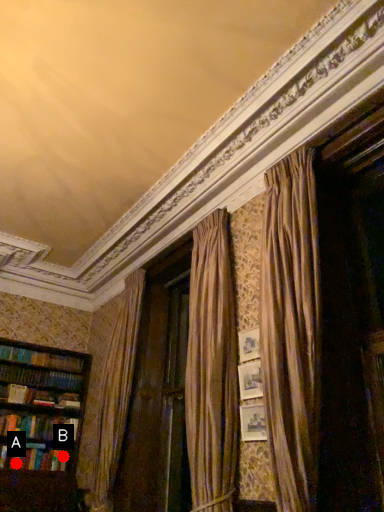
Question: Two points are circled on the image, labeled by A and B beside each circle. Which point is farther to the camera?

Choices:
 (A) A is further
 (B) B is further

Answer: (B)